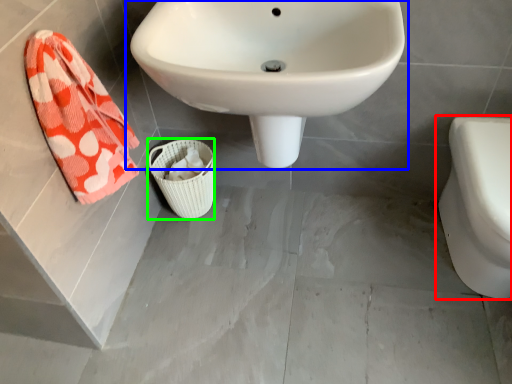
Question: Which is nearer to the toilet (highlighted by a red box)? sink (highlighted by a blue box) or basket (highlighted by a green box).

Choices:
 (A) sink
 (B) basket

Answer: (A)